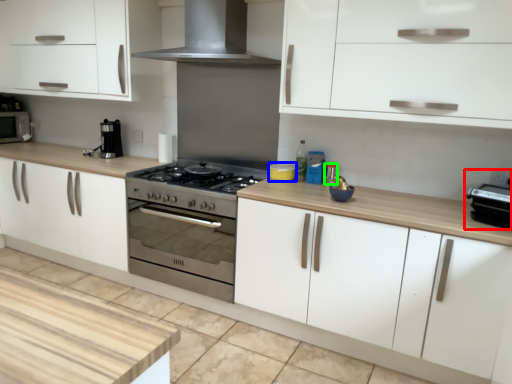
Question: Estimate the real-world distances between objects in this image. Which object is farther from appliance (highlighted by a red box), appliance (highlighted by a blue box) or appliance (highlighted by a green box)?

Choices:
 (A) appliance
 (B) appliance

Answer: (A)